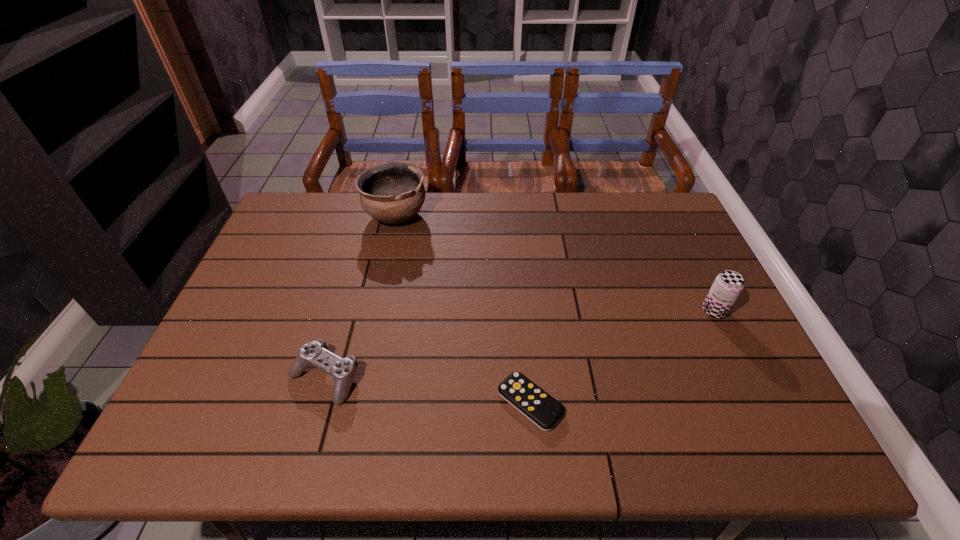
Locate an element on the screen. the farthest object is located at coordinates (393, 192).

Identify the location of the rightmost object. This screenshot has height=540, width=960. (728, 285).

The height and width of the screenshot is (540, 960). Find the location of `the third nearest object`. the third nearest object is located at coordinates (728, 285).

This screenshot has height=540, width=960. In order to click on the second shortest object in this screenshot , I will do click(x=343, y=370).

Identify the location of the shortest object. (534, 403).

This screenshot has height=540, width=960. Find the location of `the second object from right to left`. the second object from right to left is located at coordinates (534, 403).

I want to click on free space located 0.200m on the right of the farthest object, so click(x=488, y=215).

Image resolution: width=960 pixels, height=540 pixels. In order to click on free space located on the left of the third shortest object in this screenshot , I will do `click(642, 311)`.

What are the coordinates of `blank area located on the right of the control` in the screenshot? It's located at (415, 377).

The image size is (960, 540). Identify the location of vacant space positioned on the back of the shortest object. (522, 308).